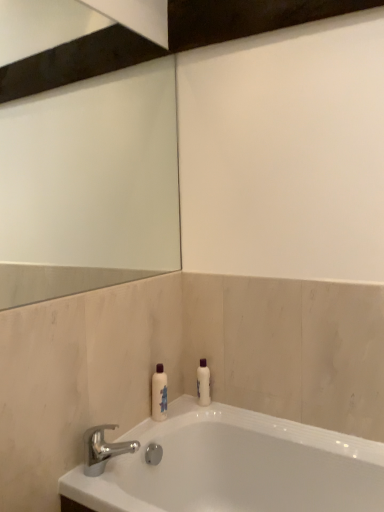
Question: Considering the positions of white glossy bottle at center and white glossy bathtub at lower center in the image, is white glossy bottle at center wider or thinner than white glossy bathtub at lower center?

Choices:
 (A) thin
 (B) wide

Answer: (A)

Question: From a real-world perspective, is white glossy bottle at center physically located above or below white glossy bathtub at lower center?

Choices:
 (A) below
 (B) above

Answer: (B)

Question: Estimate the real-world distances between objects in this image. Which object is closer to the white glossy bottle at center?

Choices:
 (A) white glossy bathtub at lower center
 (B) silver metallic faucet at lower left

Answer: (B)

Question: Which object is positioned farthest from the silver metallic faucet at lower left?

Choices:
 (A) white glossy bottle at center
 (B) white glossy bathtub at lower center

Answer: (B)